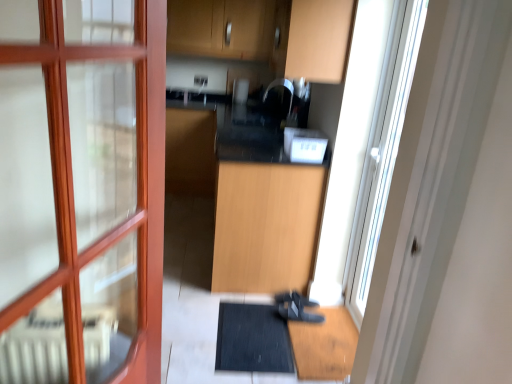
Question: Is black rubber bath mat at lower center positioned with its back to transparent glass screen door at right?

Choices:
 (A) no
 (B) yes

Answer: (A)

Question: Considering the relative sizes of black rubber bath mat at lower center and transparent glass screen door at right in the image provided, is black rubber bath mat at lower center thinner than transparent glass screen door at right?

Choices:
 (A) yes
 (B) no

Answer: (B)

Question: Is black rubber bath mat at lower center taller than transparent glass screen door at right?

Choices:
 (A) yes
 (B) no

Answer: (B)

Question: From a real-world perspective, is black rubber bath mat at lower center on transparent glass screen door at right?

Choices:
 (A) yes
 (B) no

Answer: (B)

Question: Considering the relative sizes of black rubber bath mat at lower center and transparent glass screen door at right in the image provided, is black rubber bath mat at lower center smaller than transparent glass screen door at right?

Choices:
 (A) yes
 (B) no

Answer: (A)

Question: From a real-world perspective, is black rubber bath mat at lower center physically below transparent glass screen door at right?

Choices:
 (A) no
 (B) yes

Answer: (B)

Question: Considering the relative positions of white plastic toaster at center and black matte shoe at lower center in the image provided, is white plastic toaster at center to the left of black matte shoe at lower center from the viewer's perspective?

Choices:
 (A) no
 (B) yes

Answer: (B)

Question: Is white plastic toaster at center oriented away from black matte shoe at lower center?

Choices:
 (A) no
 (B) yes

Answer: (A)

Question: Does white plastic toaster at center lie behind black matte shoe at lower center?

Choices:
 (A) no
 (B) yes

Answer: (A)

Question: Can you confirm if white plastic toaster at center is taller than black matte shoe at lower center?

Choices:
 (A) no
 (B) yes

Answer: (B)

Question: From a real-world perspective, is white plastic toaster at center physically below black matte shoe at lower center?

Choices:
 (A) no
 (B) yes

Answer: (A)

Question: Considering the relative sizes of white plastic toaster at center and black matte shoe at lower center in the image provided, is white plastic toaster at center bigger than black matte shoe at lower center?

Choices:
 (A) yes
 (B) no

Answer: (A)

Question: Is light wood cabinet at center, which is the second cabinetry from top to bottom, not within black rubber bath mat at lower center?

Choices:
 (A) no
 (B) yes

Answer: (B)